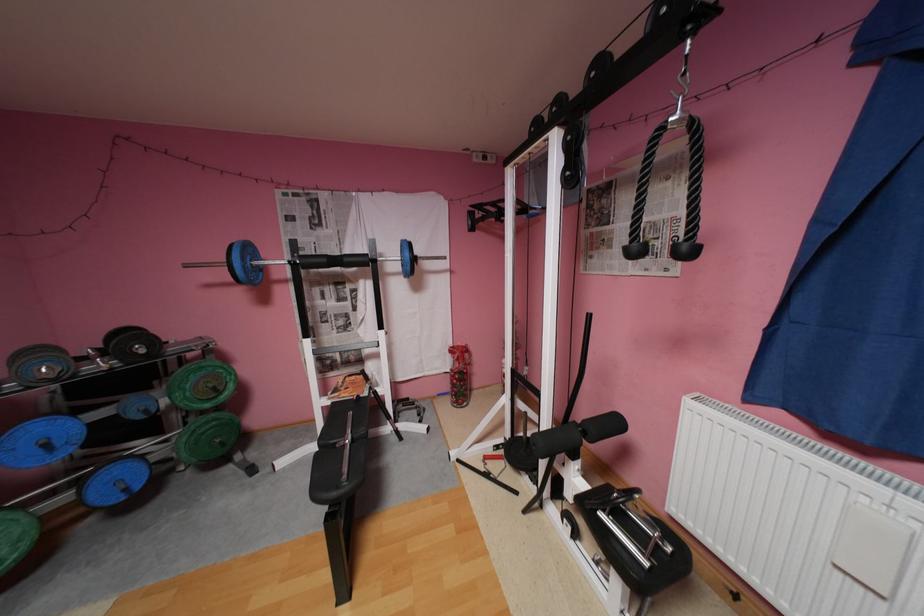
Image resolution: width=924 pixels, height=616 pixels. Find the location of `metal v-bar handle`. metal v-bar handle is located at coordinates (301, 262).